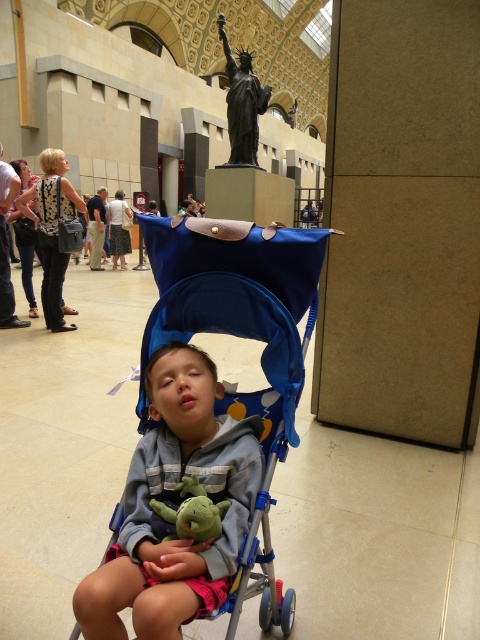
Does blue fabric baby carriage at center have a greater width compared to green plush toy at center?

Correct, the width of blue fabric baby carriage at center exceeds that of green plush toy at center.

Does blue fabric baby carriage at center appear over green plush toy at center?

Correct, blue fabric baby carriage at center is located above green plush toy at center.

At what (x,y) coordinates should I click in order to perform the action: click on blue fabric baby carriage at center. Please return your answer as a coordinate pair (x, y). The width and height of the screenshot is (480, 640). Looking at the image, I should click on (238, 310).

Who is more distant from viewer, (227, 108) or (197, 538)?

Positioned behind is point (227, 108).

Is bronze statue at center wider than green plush toy at center?

Correct, the width of bronze statue at center exceeds that of green plush toy at center.

Who is more distant from viewer, [250,90] or [211,502]?

Point [250,90]

Locate an element on the screen. bronze statue at center is located at coordinates (242, 104).

The height and width of the screenshot is (640, 480). What do you see at coordinates (175, 506) in the screenshot? I see `gray fleece jacket at center` at bounding box center [175, 506].

Which is behind, point (199, 461) or point (208, 508)?

The point (199, 461) is behind.

This screenshot has width=480, height=640. I want to click on gray fleece jacket at center, so [175, 506].

You are a GUI agent. You are given a task and a screenshot of the screen. Output one action in this format:
    pyautogui.click(x=<x>, y=<y>)
    Task: Click on the gray fleece jacket at center
    
    Given the screenshot: What is the action you would take?
    pyautogui.click(x=175, y=506)